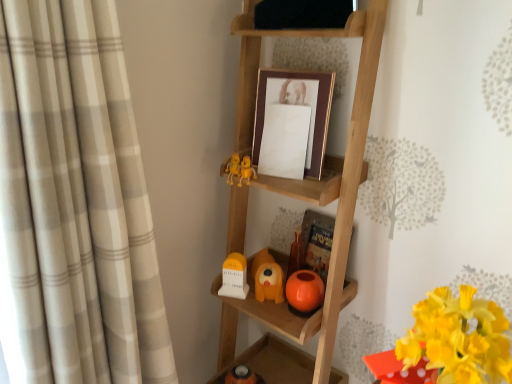
Question: From their relative heights in the image, would you say white matte clock at lower center, acting as the 2th toy starting from the right, is taller or shorter than beige plaid curtain at left?

Choices:
 (A) tall
 (B) short

Answer: (B)

Question: Looking at their shapes, would you say white matte clock at lower center, acting as the 2th toy starting from the right, is wider or thinner than beige plaid curtain at left?

Choices:
 (A) thin
 (B) wide

Answer: (A)

Question: Which of these objects is positioned closest to the beige plaid curtain at left?

Choices:
 (A) white matte clock at lower center, acting as the 2th toy starting from the right
 (B) wooden ladder at center, the second shelf viewed from the top
 (C) black matte shelf at upper center, which is counted as the first shelf, starting from the top
 (D) orange matte dog at center, the first toy when ordered from right to left
 (E) yellow matte flower at lower right

Answer: (B)

Question: Estimate the real-world distances between objects in this image. Which object is farther from the wooden ladder at center, the second shelf viewed from the top?

Choices:
 (A) yellow matte flower at lower right
 (B) black matte shelf at upper center, which is counted as the first shelf, starting from the top
 (C) orange matte dog at center, arranged as the 2th toy when viewed from the left
 (D) beige plaid curtain at left
 (E) gold/maroon picture frame at center

Answer: (D)